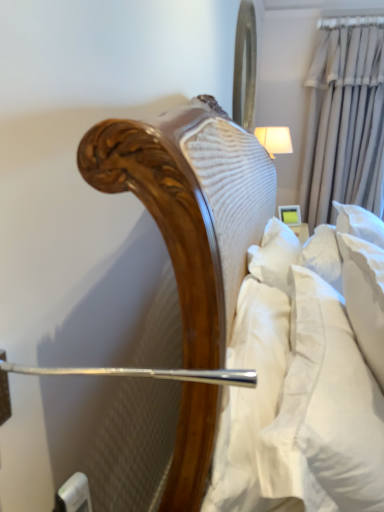
Question: Is metallic reflective mirror at upper center closer to camera compared to white fabric lampshade at upper right?

Choices:
 (A) yes
 (B) no

Answer: (A)

Question: Would you say metallic reflective mirror at upper center is a long distance from white fabric lampshade at upper right?

Choices:
 (A) yes
 (B) no

Answer: (B)

Question: Can you confirm if metallic reflective mirror at upper center is positioned to the right of white fabric lampshade at upper right?

Choices:
 (A) no
 (B) yes

Answer: (A)

Question: Does metallic reflective mirror at upper center have a lesser width compared to white fabric lampshade at upper right?

Choices:
 (A) no
 (B) yes

Answer: (B)

Question: From a real-world perspective, is metallic reflective mirror at upper center over white fabric lampshade at upper right?

Choices:
 (A) yes
 (B) no

Answer: (A)

Question: Is metallic reflective mirror at upper center outside of white fabric lampshade at upper right?

Choices:
 (A) no
 (B) yes

Answer: (B)

Question: Is white fabric lampshade at upper right positioned before metallic reflective mirror at upper center?

Choices:
 (A) no
 (B) yes

Answer: (A)

Question: Considering the relative sizes of white fabric lampshade at upper right and metallic reflective mirror at upper center in the image provided, is white fabric lampshade at upper right wider than metallic reflective mirror at upper center?

Choices:
 (A) no
 (B) yes

Answer: (B)

Question: Is white fabric lampshade at upper right outside metallic reflective mirror at upper center?

Choices:
 (A) yes
 (B) no

Answer: (A)

Question: Does white fabric lampshade at upper right have a greater height compared to metallic reflective mirror at upper center?

Choices:
 (A) no
 (B) yes

Answer: (A)

Question: From the image's perspective, is white fabric lampshade at upper right below metallic reflective mirror at upper center?

Choices:
 (A) no
 (B) yes

Answer: (B)

Question: Considering the relative sizes of white fabric lampshade at upper right and metallic reflective mirror at upper center in the image provided, is white fabric lampshade at upper right thinner than metallic reflective mirror at upper center?

Choices:
 (A) no
 (B) yes

Answer: (A)

Question: From the image's perspective, is beige fabric curtain at upper right located beneath white soft pillow at right?

Choices:
 (A) yes
 (B) no

Answer: (B)